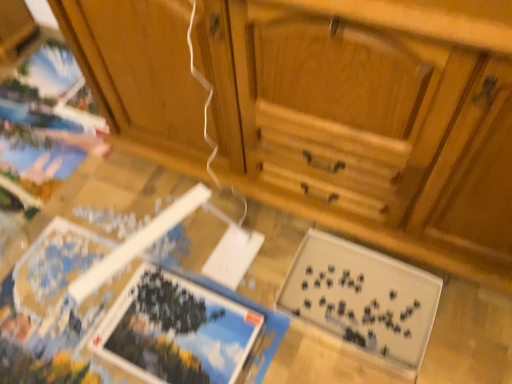
Question: Are blue glossy puzzle piece at lower left, the 1th magazine in the left-to-right sequence, and wooden puzzle pieces at lower center located far from each other?

Choices:
 (A) no
 (B) yes

Answer: (A)

Question: From the image's perspective, is blue glossy puzzle piece at lower left, the second magazine from the right, below wooden puzzle pieces at lower center?

Choices:
 (A) yes
 (B) no

Answer: (A)

Question: Is blue glossy puzzle piece at lower left, the second magazine from the right, oriented towards wooden puzzle pieces at lower center?

Choices:
 (A) yes
 (B) no

Answer: (B)

Question: Is blue glossy puzzle piece at lower left, the 1th magazine in the left-to-right sequence, bigger than wooden puzzle pieces at lower center?

Choices:
 (A) no
 (B) yes

Answer: (A)

Question: Would you say blue glossy puzzle piece at lower left, the 1th magazine in the left-to-right sequence, is outside wooden puzzle pieces at lower center?

Choices:
 (A) no
 (B) yes

Answer: (B)

Question: From the image's perspective, does blue glossy puzzle piece at lower left, the 1th magazine in the left-to-right sequence, appear higher than wooden puzzle pieces at lower center?

Choices:
 (A) yes
 (B) no

Answer: (B)

Question: Can you confirm if black matte puzzle pieces at lower right, which is counted as the 1th magazine, starting from the right, is bigger than wooden puzzle pieces at lower center?

Choices:
 (A) no
 (B) yes

Answer: (A)

Question: Does black matte puzzle pieces at lower right, which ranks as the second magazine in left-to-right order, have a lesser height compared to wooden puzzle pieces at lower center?

Choices:
 (A) yes
 (B) no

Answer: (B)

Question: Is black matte puzzle pieces at lower right, which ranks as the second magazine in left-to-right order, at the left side of wooden puzzle pieces at lower center?

Choices:
 (A) no
 (B) yes

Answer: (A)

Question: From the image's perspective, is black matte puzzle pieces at lower right, which is counted as the 1th magazine, starting from the right, under wooden puzzle pieces at lower center?

Choices:
 (A) yes
 (B) no

Answer: (A)

Question: Is black matte puzzle pieces at lower right, which ranks as the second magazine in left-to-right order, positioned beyond the bounds of wooden puzzle pieces at lower center?

Choices:
 (A) no
 (B) yes

Answer: (A)

Question: Does black matte puzzle pieces at lower right, which is counted as the 1th magazine, starting from the right, have a smaller size compared to wooden puzzle pieces at lower center?

Choices:
 (A) yes
 (B) no

Answer: (A)

Question: Is black matte puzzle pieces at lower right, which is counted as the 1th magazine, starting from the right, completely or partially outside of wooden cabinet at center?

Choices:
 (A) yes
 (B) no

Answer: (A)